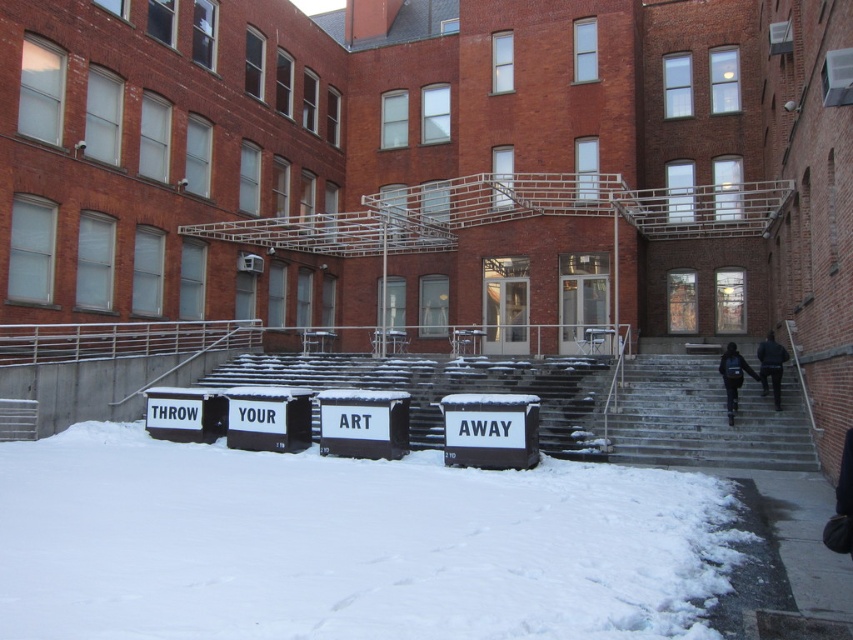
You are standing at the bottom of the smooth concrete stairs at right and want to reach the dark blue jacket at upper right. Can you see the jacket from your current position?

The smooth concrete stairs at right is not as tall as dark blue jacket at upper right, so yes, you can see the jacket from your current position because the stairs are shorter than the jacket, which is placed higher up.

You are standing in the snowy courtyard and want to go up to the second floor of the building. The stairs are located at the point indicated by the coordinates. Are the stairs at point (573, 403) the only staircase available in the courtyard?

Yes, the snow covered concrete stairs at center are the only staircase available in the courtyard as there are no other stairs mentioned in the scene description.